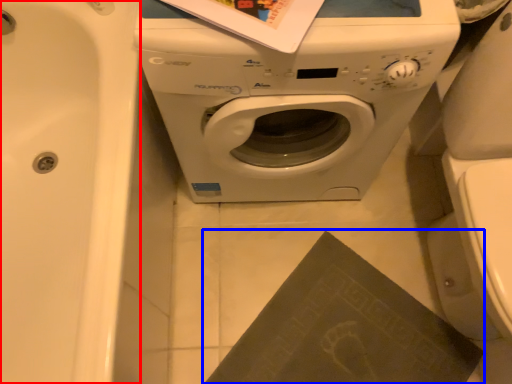
Question: Which object appears farthest to the camera in this image, bath (highlighted by a red box) or paperback book (highlighted by a blue box)?

Choices:
 (A) bath
 (B) paperback book

Answer: (B)